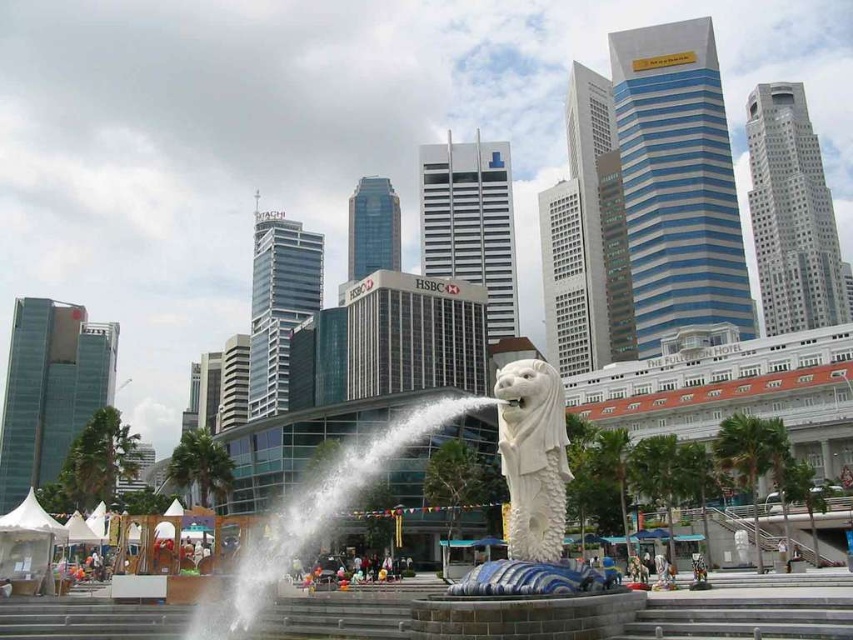
Looking at this image, you are a tourist standing at the base of the statue and want to take a photo of the white marble merlion at center and the white water at center. Which object appears taller in the photo?

The white marble merlion at center appears taller in the photo because it has a greater height compared to the white water at center.

You are standing at the base of the Merlion statue and want to take a photo that includes both the Merlion and the HSBC building in the background. You notice two points marked on your camera screen at coordinates point (524, 515) and point (550, 525). Which point should you focus on to ensure both the Merlion and the HSBC building are in focus?

You should focus on point (524, 515) because it is closer to you than point (550, 525), allowing both the Merlion in the foreground and the HSBC building in the background to be in focus.